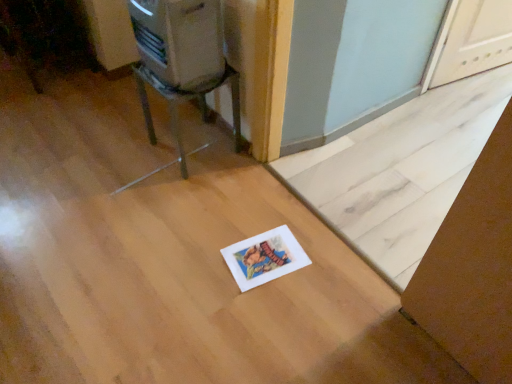
Question: From the image's perspective, is white paper at lower center beneath metallic silver appliance at upper left?

Choices:
 (A) no
 (B) yes

Answer: (B)

Question: Can you confirm if white paper at lower center is taller than metallic silver appliance at upper left?

Choices:
 (A) no
 (B) yes

Answer: (A)

Question: Considering the relative sizes of white paper at lower center and metallic silver appliance at upper left in the image provided, is white paper at lower center wider than metallic silver appliance at upper left?

Choices:
 (A) no
 (B) yes

Answer: (B)

Question: Would you say white paper at lower center is outside metallic silver appliance at upper left?

Choices:
 (A) yes
 (B) no

Answer: (A)

Question: Is white paper at lower center at the right side of metallic silver appliance at upper left?

Choices:
 (A) yes
 (B) no

Answer: (A)

Question: From the image's perspective, is white paper at lower center above or below metallic silver chair at upper left?

Choices:
 (A) above
 (B) below

Answer: (B)

Question: Is white paper at lower center bigger or smaller than metallic silver chair at upper left?

Choices:
 (A) big
 (B) small

Answer: (A)

Question: Is white paper at lower center taller or shorter than metallic silver chair at upper left?

Choices:
 (A) tall
 (B) short

Answer: (B)

Question: Is white paper at lower center spatially inside metallic silver chair at upper left, or outside of it?

Choices:
 (A) outside
 (B) inside

Answer: (A)

Question: Is point (143, 44) positioned closer to the camera than point (133, 182)?

Choices:
 (A) closer
 (B) farther

Answer: (A)

Question: Considering the positions of metallic silver appliance at upper left and metallic silver chair at upper left in the image, is metallic silver appliance at upper left taller or shorter than metallic silver chair at upper left?

Choices:
 (A) short
 (B) tall

Answer: (A)

Question: Relative to metallic silver chair at upper left, is metallic silver appliance at upper left in front or behind?

Choices:
 (A) behind
 (B) front

Answer: (B)

Question: From a real-world perspective, relative to metallic silver chair at upper left, is metallic silver appliance at upper left vertically above or below?

Choices:
 (A) below
 (B) above

Answer: (B)

Question: Which is correct: metallic silver chair at upper left is inside metallic silver appliance at upper left, or outside of it?

Choices:
 (A) outside
 (B) inside

Answer: (A)

Question: From their relative heights in the image, would you say metallic silver chair at upper left is taller or shorter than metallic silver appliance at upper left?

Choices:
 (A) tall
 (B) short

Answer: (A)